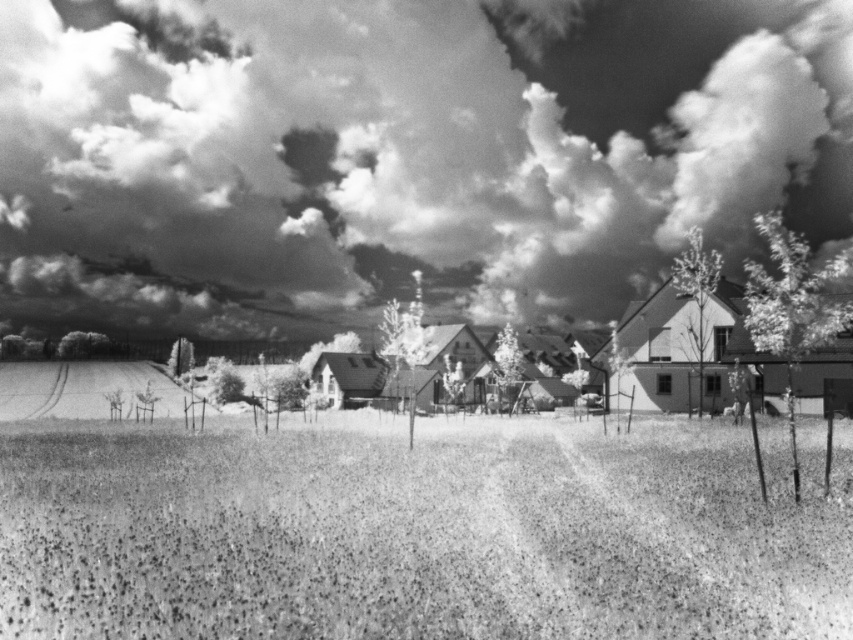
Measure the distance between cloudy sky at upper center and camera.

cloudy sky at upper center and camera are 121.62 meters apart.

Does cloudy sky at upper center have a larger size compared to grainy grass at center?

Yes, cloudy sky at upper center is bigger than grainy grass at center.

Between point (376, 108) and point (318, 525), which one is positioned behind?

The point (376, 108) is more distant.

This screenshot has width=853, height=640. In order to click on cloudy sky at upper center in this screenshot , I will do `click(402, 152)`.